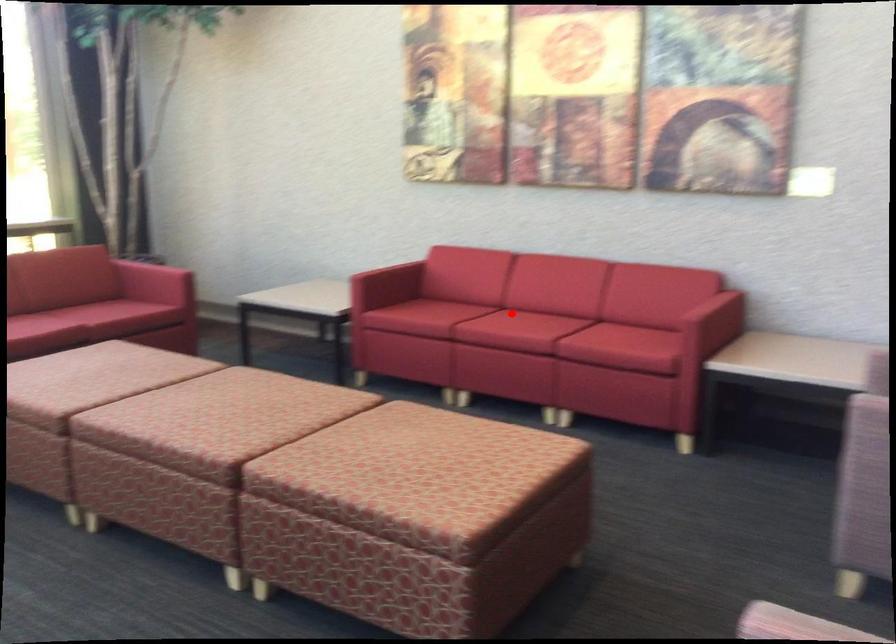
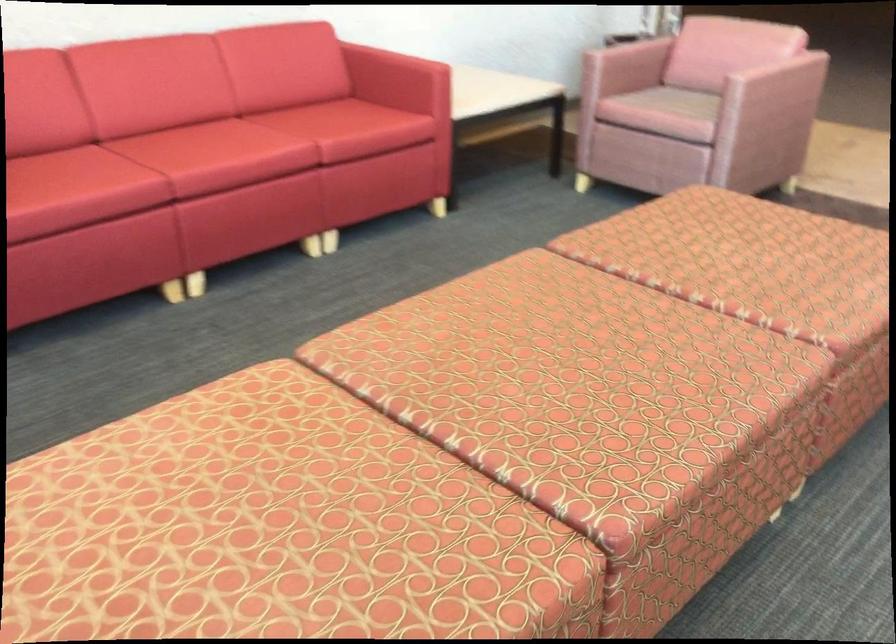
Locate, in the second image, the point that corresponds to the highlighted location in the first image.

(196, 144)